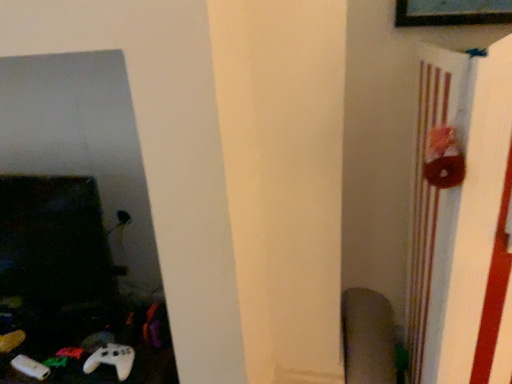
Question: Is velvet-like gray swivel chair at lower right smaller than brown fabric bulletin board at right?

Choices:
 (A) no
 (B) yes

Answer: (B)

Question: Does velvet-like gray swivel chair at lower right have a greater height compared to brown fabric bulletin board at right?

Choices:
 (A) yes
 (B) no

Answer: (B)

Question: Could you tell me if velvet-like gray swivel chair at lower right is facing brown fabric bulletin board at right?

Choices:
 (A) yes
 (B) no

Answer: (B)

Question: Is velvet-like gray swivel chair at lower right to the left of brown fabric bulletin board at right from the viewer's perspective?

Choices:
 (A) yes
 (B) no

Answer: (A)

Question: Is velvet-like gray swivel chair at lower right surrounding brown fabric bulletin board at right?

Choices:
 (A) yes
 (B) no

Answer: (B)

Question: Is white matte game controller at lower left spatially inside brown fabric bulletin board at right, or outside of it?

Choices:
 (A) inside
 (B) outside

Answer: (B)

Question: Looking at the image, does white matte game controller at lower left seem bigger or smaller compared to brown fabric bulletin board at right?

Choices:
 (A) big
 (B) small

Answer: (B)

Question: Would you say white matte game controller at lower left is to the left or to the right of brown fabric bulletin board at right in the picture?

Choices:
 (A) left
 (B) right

Answer: (A)

Question: In the image, is white matte game controller at lower left positioned in front of or behind brown fabric bulletin board at right?

Choices:
 (A) front
 (B) behind

Answer: (B)

Question: Which is correct: brown fabric bulletin board at right is inside white matte game controller at lower left, or outside of it?

Choices:
 (A) inside
 (B) outside

Answer: (B)

Question: Considering the positions of brown fabric bulletin board at right and white matte game controller at lower left in the image, is brown fabric bulletin board at right bigger or smaller than white matte game controller at lower left?

Choices:
 (A) small
 (B) big

Answer: (B)

Question: From a real-world perspective, is brown fabric bulletin board at right physically located above or below white matte game controller at lower left?

Choices:
 (A) below
 (B) above

Answer: (B)

Question: Considering their positions, is brown fabric bulletin board at right located in front of or behind white matte game controller at lower left?

Choices:
 (A) behind
 (B) front

Answer: (B)

Question: Is velvet-like gray swivel chair at lower right in front of or behind brown fabric bulletin board at right in the image?

Choices:
 (A) behind
 (B) front

Answer: (A)

Question: Would you say velvet-like gray swivel chair at lower right is inside or outside brown fabric bulletin board at right?

Choices:
 (A) outside
 (B) inside

Answer: (A)